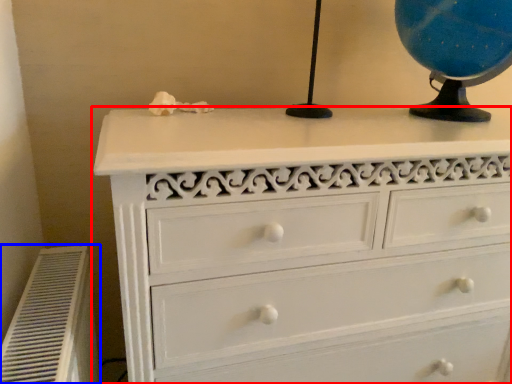
Question: Which object appears closest to the camera in this image, chest of drawers (highlighted by a red box) or air conditioner (highlighted by a blue box)?

Choices:
 (A) chest of drawers
 (B) air conditioner

Answer: (B)